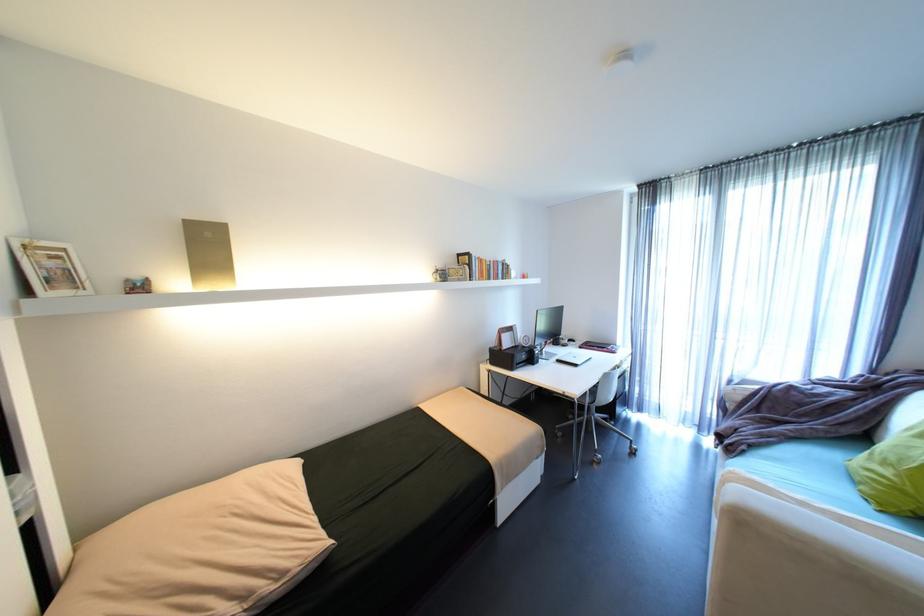
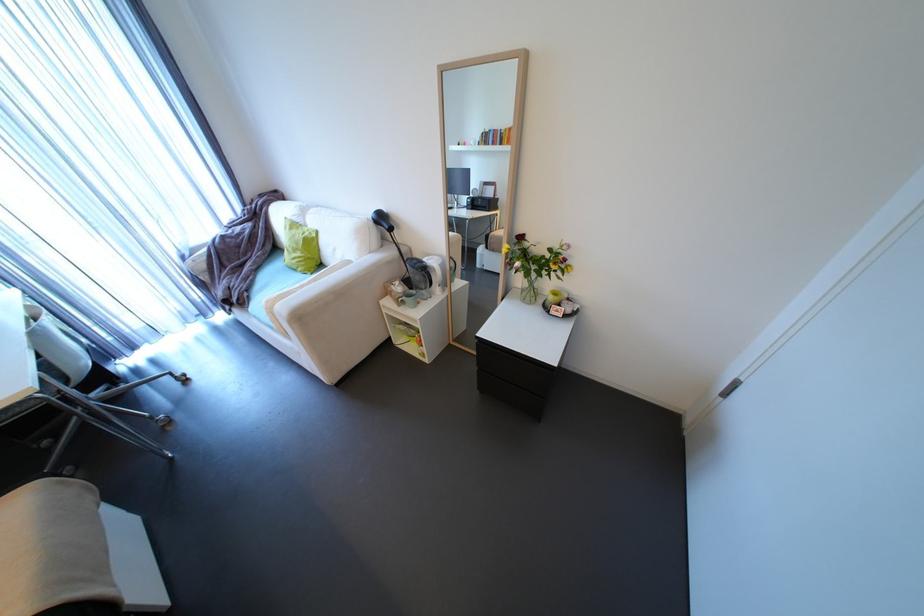
Find the pixel in the second image that matches point (743, 382) in the first image.

(195, 254)